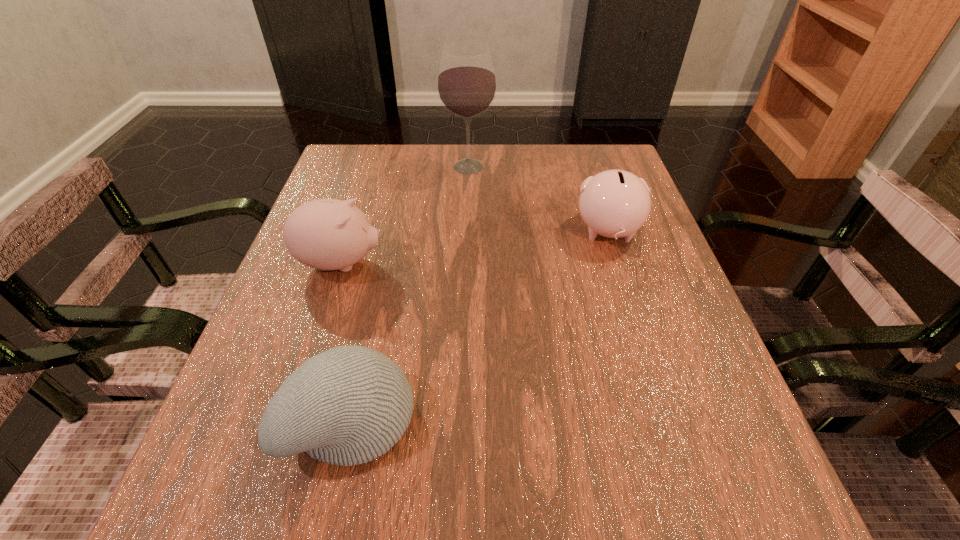
Identify the location of unoccupied area between the alcohol and the left piggy bank. (405, 215).

Where is `free space between the right piggy bank and the farthest object`? The image size is (960, 540). free space between the right piggy bank and the farthest object is located at coordinates (539, 200).

What are the coordinates of `object that is the third closest one to the left piggy bank` in the screenshot? It's located at (615, 203).

Locate which object is the second closest to the rightmost object. Please provide its 2D coordinates. Your answer should be formatted as a tuple, i.e. [(x, y)], where the tuple contains the x and y coordinates of a point satisfying the conditions above.

[(348, 405)]

Where is `vacant point that satisfies the following two spatial constraints: 1. on the front side of the right piggy bank; 2. at the snout of the left piggy bank`? Image resolution: width=960 pixels, height=540 pixels. vacant point that satisfies the following two spatial constraints: 1. on the front side of the right piggy bank; 2. at the snout of the left piggy bank is located at coordinates (618, 263).

Identify the location of vacant position in the image that satisfies the following two spatial constraints: 1. on the front side of the farthest object; 2. at the snout of the left piggy bank. (466, 263).

Image resolution: width=960 pixels, height=540 pixels. What are the coordinates of `free location that satisfies the following two spatial constraints: 1. on the front side of the rightmost object; 2. at the snout of the left piggy bank` in the screenshot? It's located at [618, 263].

This screenshot has height=540, width=960. Identify the location of free space that satisfies the following two spatial constraints: 1. on the front side of the rightmost object; 2. at the snout of the left piggy bank. (618, 263).